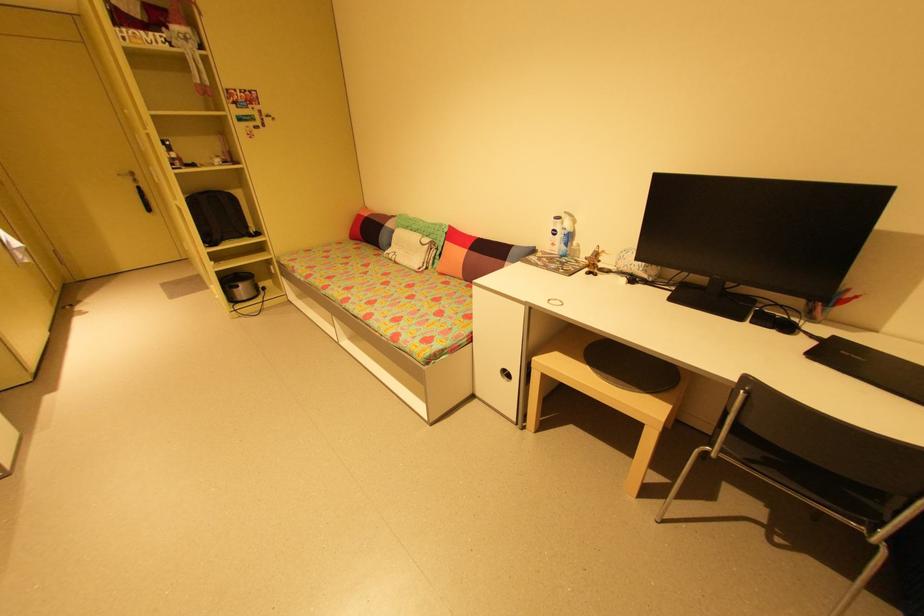
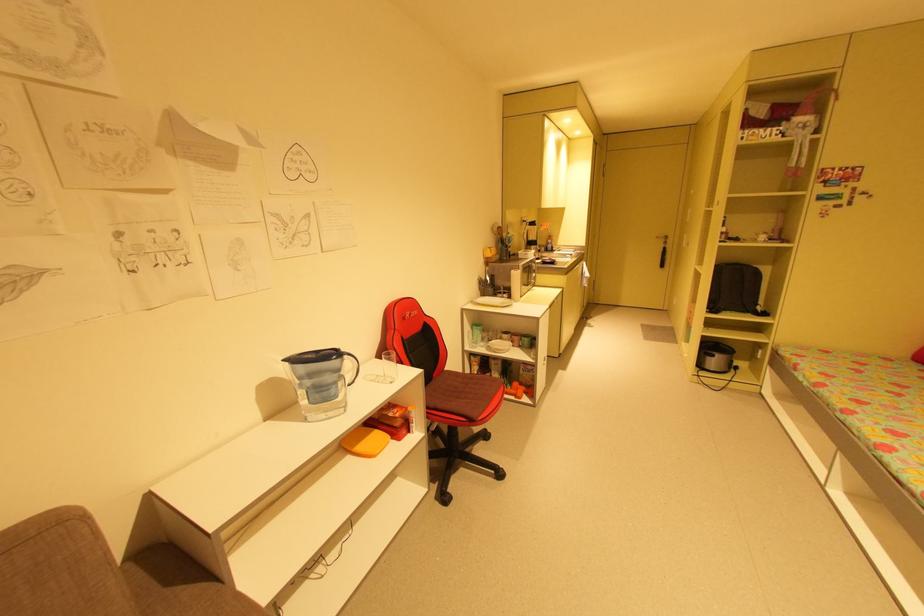
Question: The first image is from the beginning of the video and the second image is from the end. How did the camera likely rotate when shooting the video?

Choices:
 (A) Left
 (B) Right
 (C) Up
 (D) Down

Answer: (A)